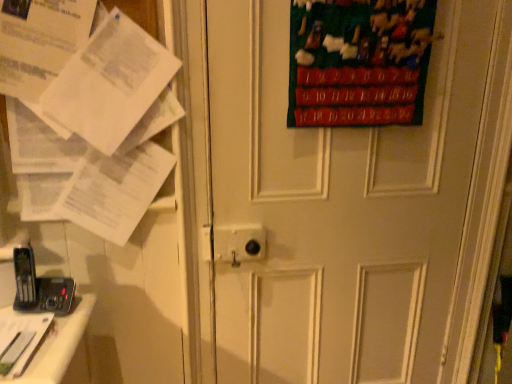
Question: Should I look upward or downward to see velvet green poster at upper right?

Choices:
 (A) up
 (B) down

Answer: (A)

Question: From a real-world perspective, is black plastic phone at lower left located higher than white matte door at center?

Choices:
 (A) yes
 (B) no

Answer: (B)

Question: Is black plastic phone at lower left bigger than white matte door at center?

Choices:
 (A) yes
 (B) no

Answer: (B)

Question: Is black plastic phone at lower left oriented towards white matte door at center?

Choices:
 (A) no
 (B) yes

Answer: (A)

Question: Is black plastic phone at lower left placed right next to white matte door at center?

Choices:
 (A) yes
 (B) no

Answer: (B)

Question: Is black plastic phone at lower left positioned far away from white matte door at center?

Choices:
 (A) yes
 (B) no

Answer: (B)

Question: Is the depth of black plastic phone at lower left less than that of white matte door at center?

Choices:
 (A) yes
 (B) no

Answer: (B)

Question: Are white paper at left and white matte door at center located far from each other?

Choices:
 (A) yes
 (B) no

Answer: (B)

Question: Is white paper at left next to white matte door at center?

Choices:
 (A) yes
 (B) no

Answer: (B)

Question: Can you confirm if white paper at left is shorter than white matte door at center?

Choices:
 (A) yes
 (B) no

Answer: (A)

Question: Can you confirm if white paper at left is positioned to the right of white matte door at center?

Choices:
 (A) no
 (B) yes

Answer: (A)

Question: Is white paper at left to the left of white matte door at center from the viewer's perspective?

Choices:
 (A) yes
 (B) no

Answer: (A)

Question: From the image's perspective, would you say white paper at left is shown under white matte door at center?

Choices:
 (A) no
 (B) yes

Answer: (A)

Question: Can you confirm if black plastic phone at lower left is thinner than white paper at left?

Choices:
 (A) no
 (B) yes

Answer: (B)